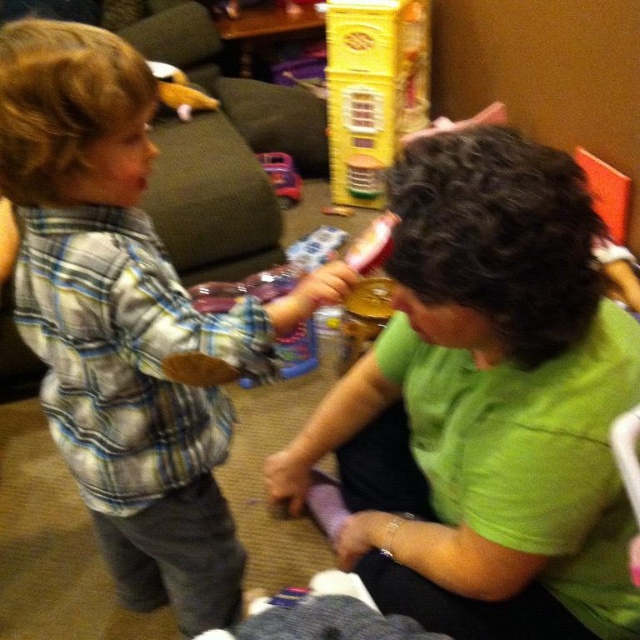
Which is above, green matte shirt at center or plastic toy car at center?

plastic toy car at center is above.

Is green matte shirt at center to the left of plastic toy car at center from the viewer's perspective?

Incorrect, green matte shirt at center is not on the left side of plastic toy car at center.

Describe the element at coordinates (484, 404) in the screenshot. This screenshot has width=640, height=640. I see `green matte shirt at center` at that location.

Locate an element on the screen. green matte shirt at center is located at coordinates (484, 404).

Consider the image. Does green matte shirt at center have a greater width compared to yellow plastic dollhouse at upper center?

Indeed, green matte shirt at center has a greater width compared to yellow plastic dollhouse at upper center.

Can you confirm if green matte shirt at center is shorter than yellow plastic dollhouse at upper center?

Indeed, green matte shirt at center has a lesser height compared to yellow plastic dollhouse at upper center.

The image size is (640, 640). I want to click on green matte shirt at center, so click(484, 404).

What are the coordinates of `green matte shirt at center` in the screenshot? It's located at (484, 404).

Can you confirm if plaid cotton shirt at left is thinner than plastic toy car at center?

In fact, plaid cotton shirt at left might be wider than plastic toy car at center.

Is plaid cotton shirt at left to the right of plastic toy car at center from the viewer's perspective?

Incorrect, plaid cotton shirt at left is not on the right side of plastic toy car at center.

Image resolution: width=640 pixels, height=640 pixels. Find the location of `plaid cotton shirt at left`. plaid cotton shirt at left is located at coordinates (128, 321).